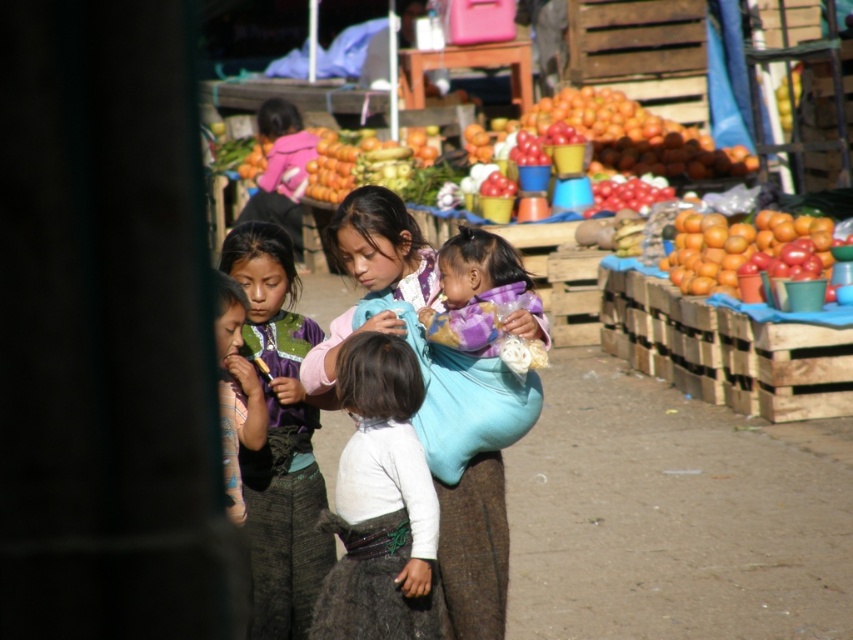
What do you see at coordinates (473, 492) in the screenshot? I see `matte purple fabric at center` at bounding box center [473, 492].

How far apart are matte purple fabric at center and orange matte/orange at right?

A distance of 8.78 meters exists between matte purple fabric at center and orange matte/orange at right.

The image size is (853, 640). I want to click on matte purple fabric at center, so click(x=473, y=492).

Find the location of a particular element. Image resolution: width=853 pixels, height=640 pixels. matte purple fabric at center is located at coordinates (473, 492).

Is matte purple fabric at center thinner than purple fabric at center?

In fact, matte purple fabric at center might be wider than purple fabric at center.

Between matte purple fabric at center and purple fabric at center, which one has less height?

purple fabric at center

Which is in front, point (352, 253) or point (268, 275)?

Positioned in front is point (352, 253).

Locate an element on the screen. The width and height of the screenshot is (853, 640). matte purple fabric at center is located at coordinates (473, 492).

Which of these two, white soft shirt at center or purple fabric at center, stands taller?

purple fabric at center is taller.

Does white soft shirt at center have a greater height compared to purple fabric at center?

In fact, white soft shirt at center may be shorter than purple fabric at center.

Measure the distance between white soft shirt at center and camera.

white soft shirt at center is 22.96 feet from camera.

Where is `white soft shirt at center`? white soft shirt at center is located at coordinates (380, 502).